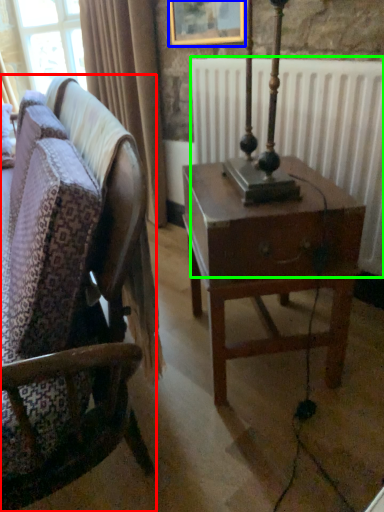
Question: Which object is positioned farthest from chair (highlighted by a red box)? Select from picture frame (highlighted by a blue box) and radiator (highlighted by a green box).

Choices:
 (A) picture frame
 (B) radiator

Answer: (A)